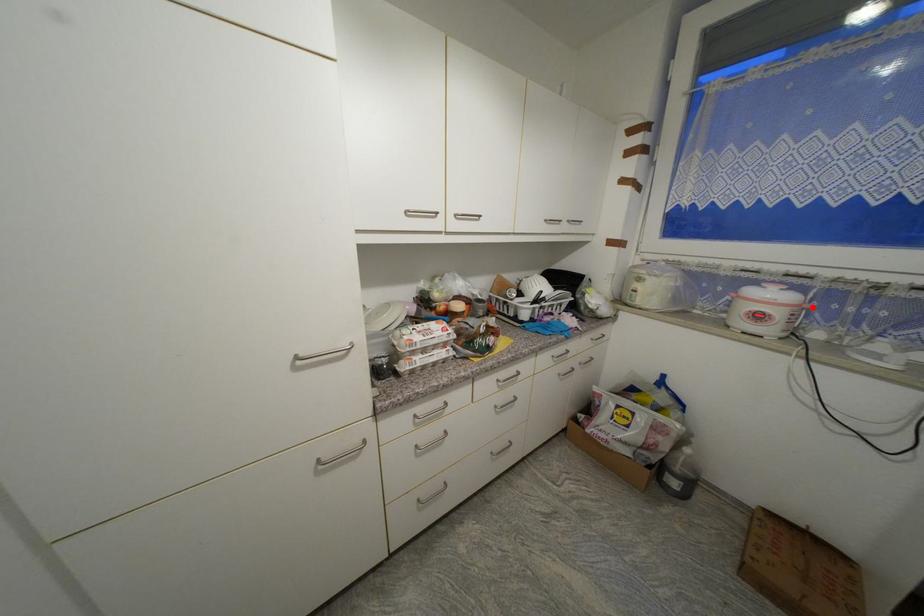
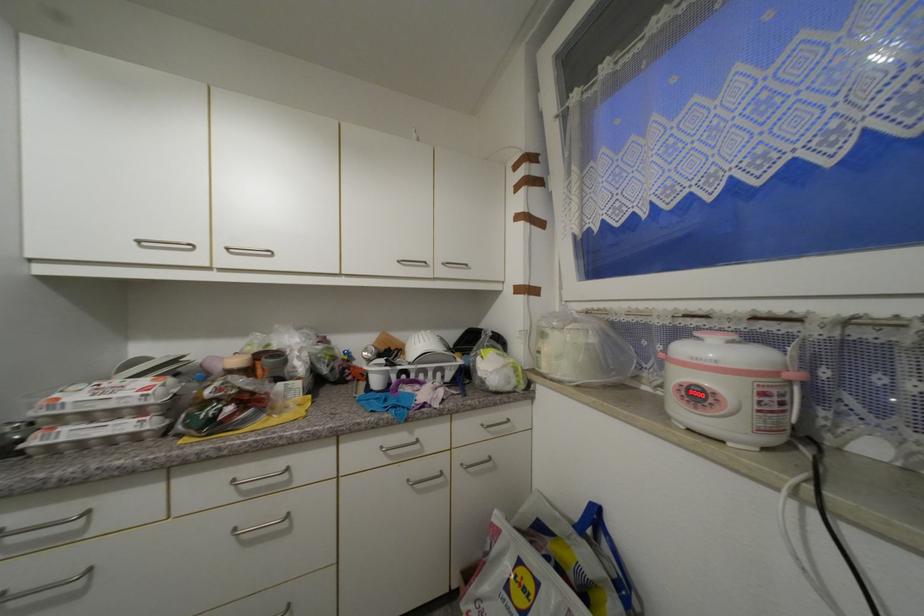
Locate, in the second image, the point that corresponds to the highlighted location in the first image.

(799, 378)